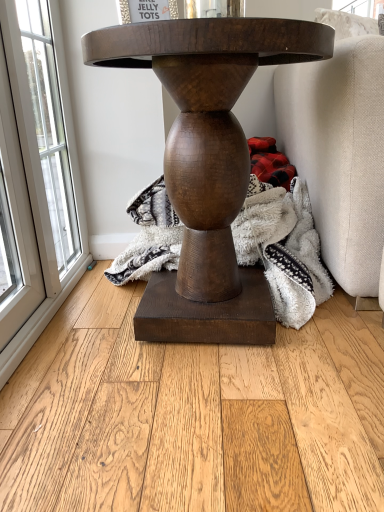
Question: Is matte brown wooden table at center wider or thinner than natural wood flooring at center?

Choices:
 (A) wide
 (B) thin

Answer: (B)

Question: From a real-world perspective, is matte brown wooden table at center positioned above or below natural wood flooring at center?

Choices:
 (A) above
 (B) below

Answer: (A)

Question: Which object is the closest to the natural wood flooring at center?

Choices:
 (A) matte brown wooden table at center
 (B) clear glass window at left
 (C) fuzzy white blanket at center
 (D) red plaid fabric at lower right

Answer: (A)

Question: Which object is the closest to the natural wood flooring at center?

Choices:
 (A) matte brown wooden table at center
 (B) red plaid fabric at lower right
 (C) clear glass window at left
 (D) fuzzy white blanket at center

Answer: (A)